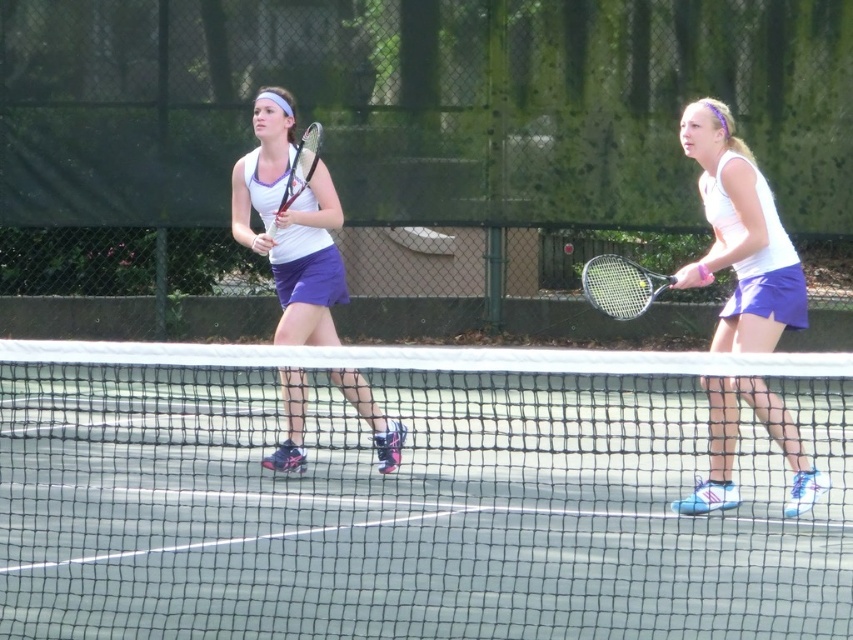
Question: Can you confirm if white matte tennis racket at right is positioned below matte white tank top at center?

Choices:
 (A) yes
 (B) no

Answer: (A)

Question: Is white matte tennis racket at right further to camera compared to black matte tennis racket at right?

Choices:
 (A) no
 (B) yes

Answer: (A)

Question: Among these points, which one is nearest to the camera?

Choices:
 (A) (607, 307)
 (B) (300, 144)
 (C) (263, 100)

Answer: (A)

Question: Which of these objects is positioned farthest from the white matte tennis racket at center?

Choices:
 (A) white mesh net at center
 (B) black matte tennis racket at right
 (C) matte white tank top at center

Answer: (A)

Question: Does white mesh net at center appear on the right side of matte white tank top at center?

Choices:
 (A) yes
 (B) no

Answer: (A)

Question: Which point is farther to the camera?

Choices:
 (A) white mesh net at center
 (B) black matte tennis racket at right

Answer: (B)